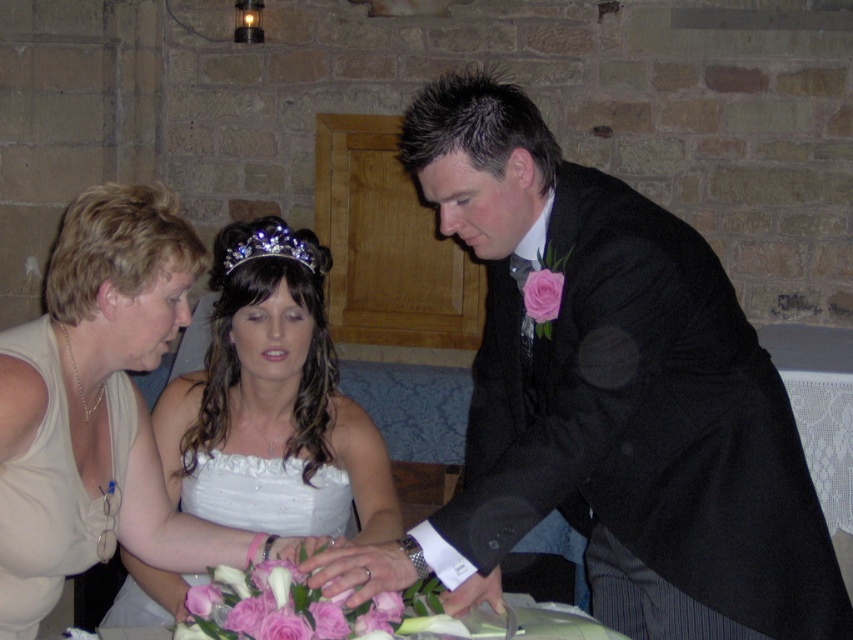
Who is taller, white satin dress at center or swarthy crystal tiara at center?

Standing taller between the two is white satin dress at center.

Can you confirm if white satin dress at center is shorter than swarthy crystal tiara at center?

Incorrect, white satin dress at center's height does not fall short of swarthy crystal tiara at center's.

Who is more distant from viewer, (245, 292) or (233, 266)?

The point (233, 266) is more distant.

At what (x,y) coordinates should I click in order to perform the action: click on white satin dress at center. Please return your answer as a coordinate pair (x, y). Looking at the image, I should click on (273, 412).

Describe the element at coordinates (605, 401) in the screenshot. This screenshot has width=853, height=640. I see `matte black suit at center` at that location.

Between matte black suit at center and swarthy crystal tiara at center, which one has more height?

Standing taller between the two is matte black suit at center.

Find the location of a particular element. The width and height of the screenshot is (853, 640). matte black suit at center is located at coordinates (605, 401).

I want to click on matte black suit at center, so click(x=605, y=401).

Measure the distance from matte black suit at center to white satin dress at center.

They are 19.91 inches apart.

Is the position of matte black suit at center less distant than that of white satin dress at center?

Yes, matte black suit at center is closer to the viewer.

The image size is (853, 640). I want to click on matte black suit at center, so click(x=605, y=401).